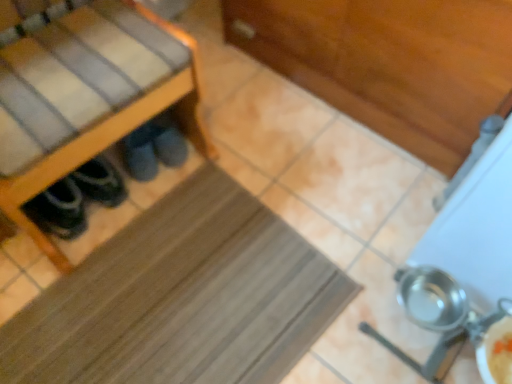
Locate an element on the screen. brown rubber mat at center is located at coordinates (182, 298).

What do you see at coordinates (88, 97) in the screenshot? This screenshot has width=512, height=384. I see `wooden shoe rack at left` at bounding box center [88, 97].

Describe the element at coordinates (153, 149) in the screenshot. I see `dark gray suede slippers at lower left` at that location.

Locate an element on the screen. This screenshot has height=384, width=512. brown rubber mat at center is located at coordinates (182, 298).

Which is more to the right, wooden shoe rack at left or brown rubber mat at center?

Positioned to the right is brown rubber mat at center.

From a real-world perspective, which is physically below, wooden shoe rack at left or brown rubber mat at center?

brown rubber mat at center, from a real-world perspective.

Does wooden shoe rack at left come in front of brown rubber mat at center?

Yes, wooden shoe rack at left is closer to the camera.

Considering the points (192, 120) and (239, 357), which point is in front, point (192, 120) or point (239, 357)?

Positioned in front is point (239, 357).

From a real-world perspective, which object rests below the other?

From a 3D spatial view, dark gray suede slippers at lower left is below.

Consider the image. Is dark gray suede slippers at lower left positioned in front of wooden shoe rack at left?

No, dark gray suede slippers at lower left is behind wooden shoe rack at left.

Is dark gray suede slippers at lower left taller than wooden shoe rack at left?

Incorrect, the height of dark gray suede slippers at lower left is not larger of that of wooden shoe rack at left.

Is metallic silver pot at lower right smaller than wooden shoe rack at left?

Correct, metallic silver pot at lower right occupies less space than wooden shoe rack at left.

Between metallic silver pot at lower right and wooden shoe rack at left, which one has smaller width?

With smaller width is metallic silver pot at lower right.

Would you say wooden shoe rack at left is part of metallic silver pot at lower right's contents?

No, wooden shoe rack at left is not a part of metallic silver pot at lower right.

Would you say metallic silver pot at lower right is a long distance from wooden shoe rack at left?

No, metallic silver pot at lower right is in close proximity to wooden shoe rack at left.

Considering the points (261, 226) and (480, 240), which point is in front, point (261, 226) or point (480, 240)?

Positioned in front is point (480, 240).

Can you confirm if brown rubber mat at center is positioned to the left of metallic silver pot at lower right?

Correct, you'll find brown rubber mat at center to the left of metallic silver pot at lower right.

Which object is thinner, brown rubber mat at center or metallic silver pot at lower right?

metallic silver pot at lower right.

Considering the sizes of objects brown rubber mat at center and metallic silver pot at lower right in the image provided, who is shorter, brown rubber mat at center or metallic silver pot at lower right?

brown rubber mat at center is shorter.

Is dark gray suede slippers at lower left inside the boundaries of brown rubber mat at center, or outside?

dark gray suede slippers at lower left is not enclosed by brown rubber mat at center.

Which object is further away from the camera taking this photo, dark gray suede slippers at lower left or brown rubber mat at center?

dark gray suede slippers at lower left is behind.

From their relative heights in the image, would you say dark gray suede slippers at lower left is taller or shorter than brown rubber mat at center?

In the image, dark gray suede slippers at lower left appears to be taller than brown rubber mat at center.

In terms of width, does metallic silver pot at lower right look wider or thinner when compared to dark gray suede slippers at lower left?

Considering their sizes, metallic silver pot at lower right looks slimmer than dark gray suede slippers at lower left.

Between metallic silver pot at lower right and dark gray suede slippers at lower left, which one has smaller size?

With smaller size is dark gray suede slippers at lower left.

In the image, is metallic silver pot at lower right positioned in front of or behind dark gray suede slippers at lower left?

Clearly, metallic silver pot at lower right is in front of dark gray suede slippers at lower left.

Can you confirm if brown rubber mat at center is smaller than wooden shoe rack at left?

Yes, brown rubber mat at center is smaller than wooden shoe rack at left.

From the image's perspective, which one is positioned lower, brown rubber mat at center or wooden shoe rack at left?

From the image's view, brown rubber mat at center is below.

Is brown rubber mat at center further to the viewer compared to wooden shoe rack at left?

Yes, brown rubber mat at center is further from the camera.

From a real-world perspective, which is physically above, brown rubber mat at center or wooden shoe rack at left?

wooden shoe rack at left.

The height and width of the screenshot is (384, 512). In order to click on furniture that is above the brown rubber mat at center (from the image's perspective) in this screenshot , I will do `click(88, 97)`.

Identify the location of footwear that is on the right side of wooden shoe rack at left. (153, 149).

When comparing their distances from dark gray suede slippers at lower left, does wooden shoe rack at left or metallic silver pot at lower right seem closer?

Based on the image, wooden shoe rack at left appears to be nearer to dark gray suede slippers at lower left.

Looking at the image, which one is located closer to wooden shoe rack at left, brown rubber mat at center or dark gray suede slippers at lower left?

The object closer to wooden shoe rack at left is dark gray suede slippers at lower left.

Which object lies nearer to the anchor point brown rubber mat at center, wooden shoe rack at left or metallic silver pot at lower right?

Based on the image, wooden shoe rack at left appears to be nearer to brown rubber mat at center.

Looking at this image, looking at the image, which one is located closer to brown rubber mat at center, wooden shoe rack at left or dark gray suede slippers at lower left?

Among the two, wooden shoe rack at left is located nearer to brown rubber mat at center.

Considering their positions, is brown rubber mat at center positioned closer to wooden shoe rack at left than metallic silver pot at lower right?

brown rubber mat at center is positioned closer to the anchor wooden shoe rack at left.

From the image, which object appears to be nearer to brown rubber mat at center, metallic silver pot at lower right or wooden shoe rack at left?

wooden shoe rack at left lies closer to brown rubber mat at center than the other object.

Which object lies further to the anchor point metallic silver pot at lower right, wooden shoe rack at left or dark gray suede slippers at lower left?

Among the two, dark gray suede slippers at lower left is located further to metallic silver pot at lower right.

From the image, which object appears to be farther from dark gray suede slippers at lower left, brown rubber mat at center or wooden shoe rack at left?

Based on the image, brown rubber mat at center appears to be further to dark gray suede slippers at lower left.

I want to click on mat situated between dark gray suede slippers at lower left and metallic silver pot at lower right from left to right, so click(182, 298).

The height and width of the screenshot is (384, 512). I want to click on mat between wooden shoe rack at left and metallic silver pot at lower right from left to right, so click(x=182, y=298).

I want to click on footwear between wooden shoe rack at left and metallic silver pot at lower right in the horizontal direction, so click(153, 149).

What are the coordinates of `mat between wooden shoe rack at left and dark gray suede slippers at lower left along the z-axis` in the screenshot? It's located at (182, 298).